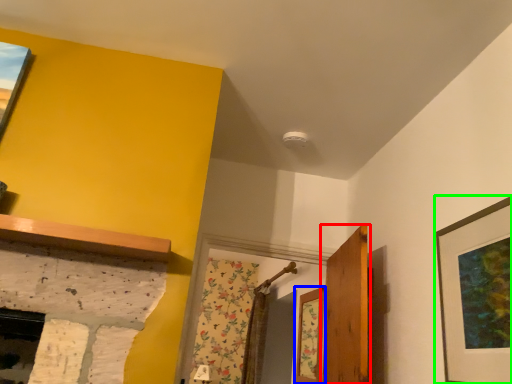
Question: Considering the real-world distances, which object is closest to door (highlighted by a red box)? window (highlighted by a blue box) or picture frame (highlighted by a green box).

Choices:
 (A) window
 (B) picture frame

Answer: (A)